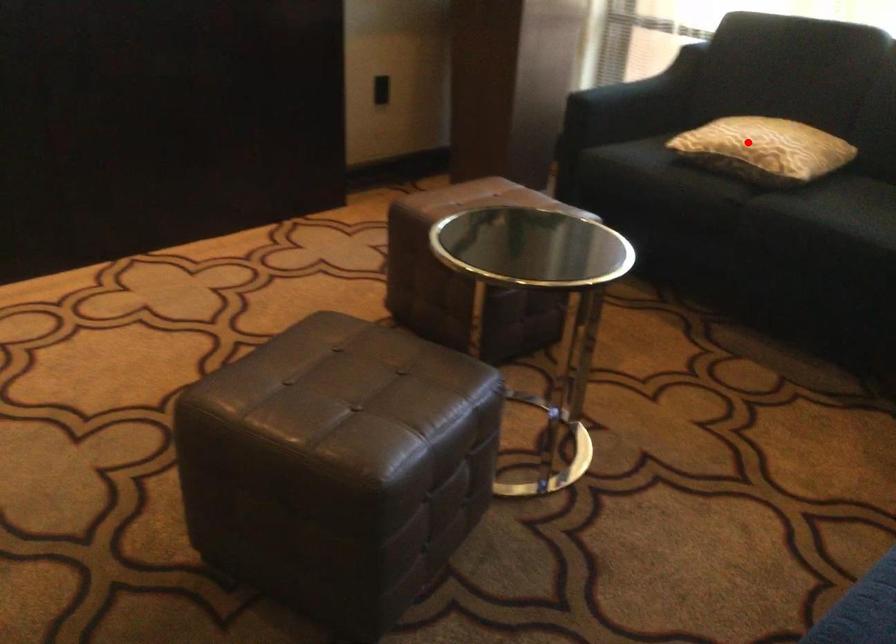
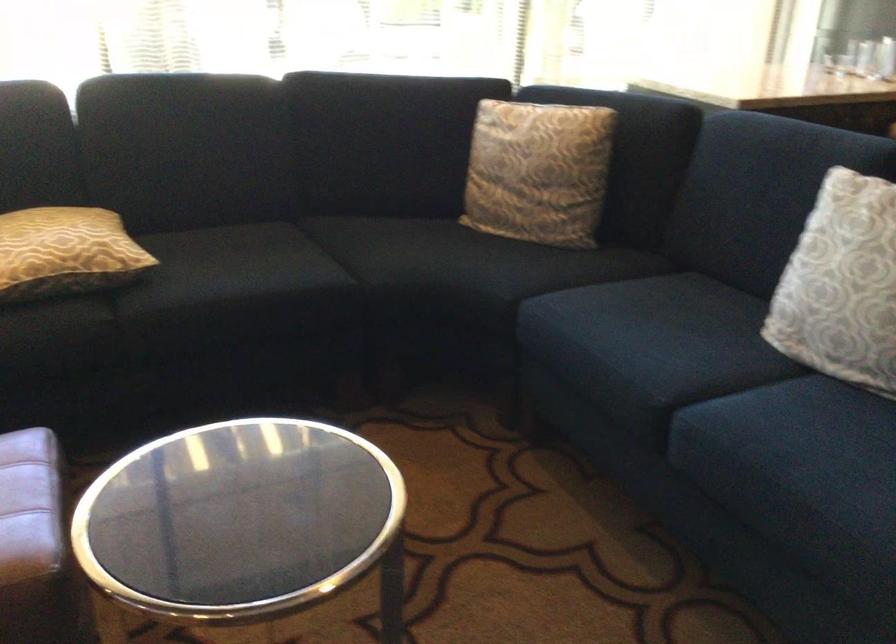
Find the pixel in the second image that matches the highlighted location in the first image.

(65, 252)